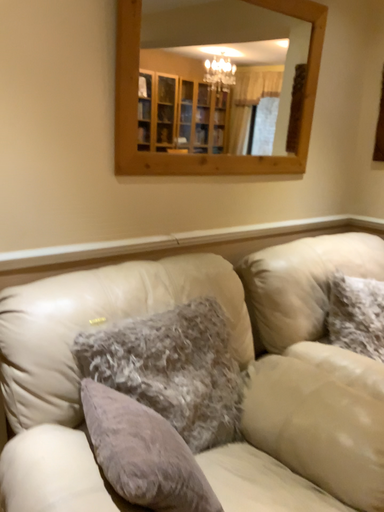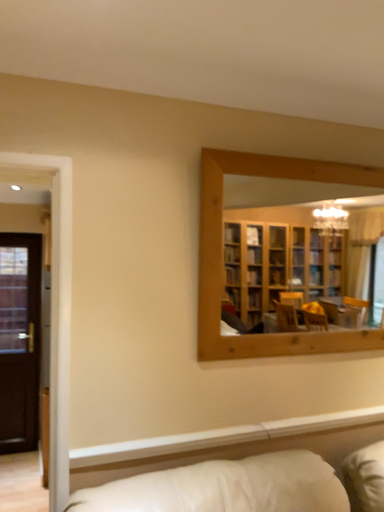
Question: How did the camera likely rotate when shooting the video?

Choices:
 (A) rotated downward
 (B) rotated upward

Answer: (B)